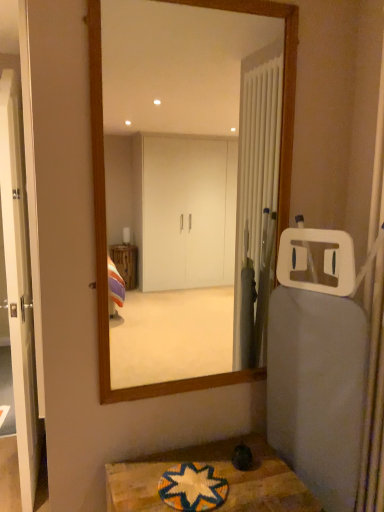
You are a GUI agent. You are given a task and a screenshot of the screen. Output one action in this format:
    pyautogui.click(x=<x>, y=<y>)
    Task: Click on the vacant point above multicolored woven mat at lower center (from a real-world perspective)
    This screenshot has width=384, height=512.
    Given the screenshot: What is the action you would take?
    pyautogui.click(x=185, y=479)